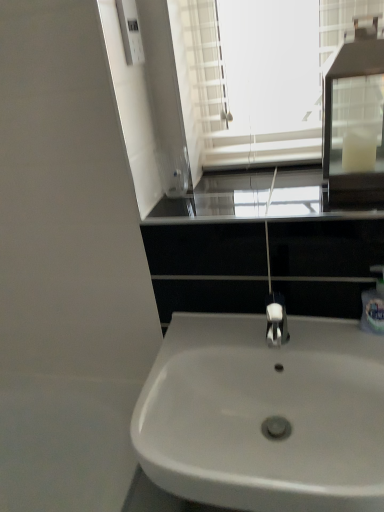
Question: From the image's perspective, is black glass window sill at center on top of white glossy sink at center?

Choices:
 (A) no
 (B) yes

Answer: (B)

Question: Is black glass window sill at center positioned in front of white glossy sink at center?

Choices:
 (A) no
 (B) yes

Answer: (A)

Question: From a real-world perspective, is black glass window sill at center on white glossy sink at center?

Choices:
 (A) no
 (B) yes

Answer: (B)

Question: Does black glass window sill at center appear on the left side of white glossy sink at center?

Choices:
 (A) no
 (B) yes

Answer: (A)

Question: Is black glass window sill at center to the right of white glossy sink at center from the viewer's perspective?

Choices:
 (A) no
 (B) yes

Answer: (B)

Question: Is black glass window sill at center taller than white glossy sink at center?

Choices:
 (A) yes
 (B) no

Answer: (B)

Question: Does white glossy sink at center have a smaller size compared to white plastic soap dispenser at right?

Choices:
 (A) yes
 (B) no

Answer: (B)

Question: Does white glossy sink at center have a greater height compared to white plastic soap dispenser at right?

Choices:
 (A) yes
 (B) no

Answer: (A)

Question: Is white glossy sink at center at the left side of white plastic soap dispenser at right?

Choices:
 (A) yes
 (B) no

Answer: (A)

Question: Would you consider white glossy sink at center to be distant from white plastic soap dispenser at right?

Choices:
 (A) yes
 (B) no

Answer: (B)

Question: From a real-world perspective, is white glossy sink at center located beneath white plastic soap dispenser at right?

Choices:
 (A) no
 (B) yes

Answer: (B)

Question: Is white glossy sink at center not inside white plastic soap dispenser at right?

Choices:
 (A) yes
 (B) no

Answer: (A)

Question: From the image's perspective, is black glass window sill at center on white plastic soap dispenser at right?

Choices:
 (A) no
 (B) yes

Answer: (B)